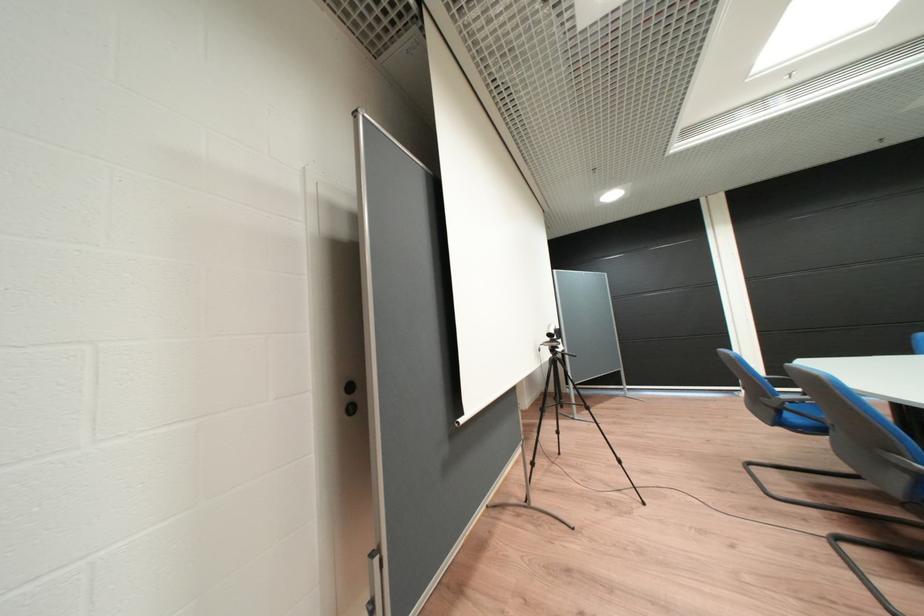
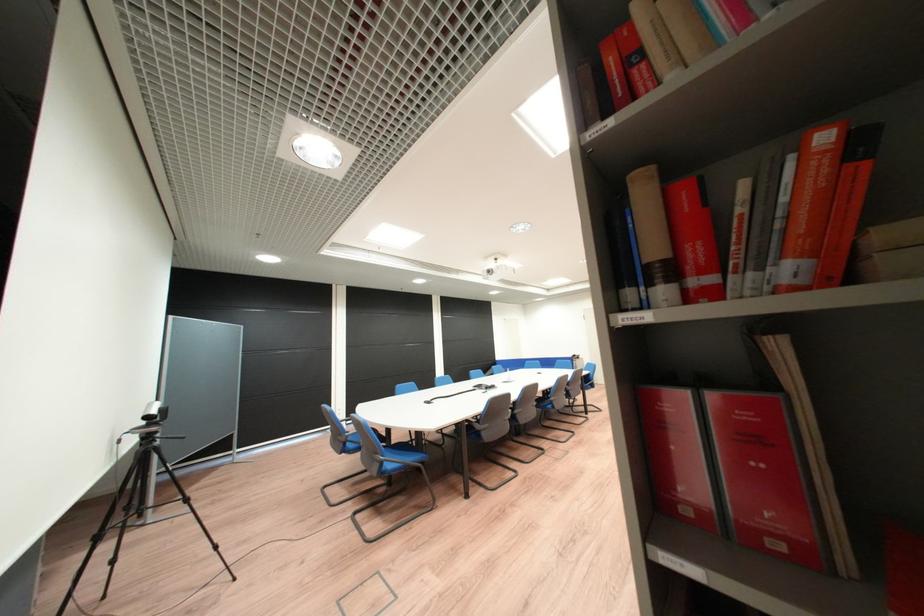
Where in the second image is the point corresponding to point 560,336 from the first image?

(159, 418)